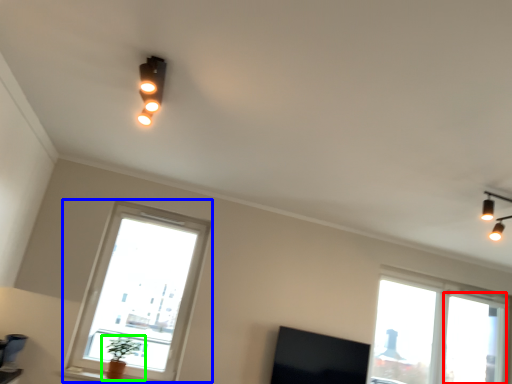
Question: Considering the real-world distances, which object is farthest from window frame (highlighted by a red box)? window (highlighted by a blue box) or houseplant (highlighted by a green box)?

Choices:
 (A) window
 (B) houseplant

Answer: (B)